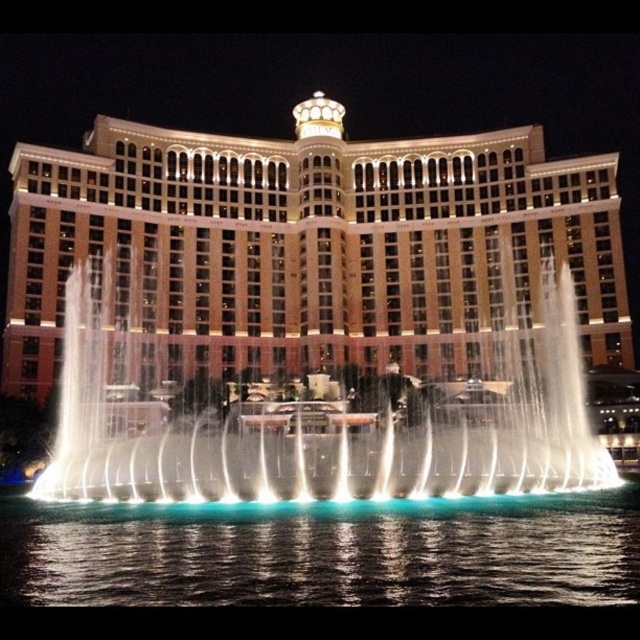
Between point (513, 372) and point (172, 520), which one is positioned behind?

The point (513, 372) is behind.

Is white water at center below blue liquid water at lower center?

No, white water at center is not below blue liquid water at lower center.

Is point (499, 435) positioned behind point (445, 525)?

Yes, point (499, 435) is behind point (445, 525).

In order to click on white water at center in this screenshot , I will do `click(317, 419)`.

Can you confirm if illuminated tan building at center is positioned to the left of white water at center?

Correct, you'll find illuminated tan building at center to the left of white water at center.

Image resolution: width=640 pixels, height=640 pixels. I want to click on illuminated tan building at center, so click(310, 244).

Image resolution: width=640 pixels, height=640 pixels. Describe the element at coordinates (310, 244) in the screenshot. I see `illuminated tan building at center` at that location.

Where is `illuminated tan building at center`? The image size is (640, 640). illuminated tan building at center is located at coordinates (310, 244).

Does point (321, 340) come in front of point (451, 588)?

That is False.

Which is behind, point (598, 209) or point (92, 595)?

Positioned behind is point (598, 209).

The width and height of the screenshot is (640, 640). Identify the location of illuminated tan building at center. (310, 244).

In order to click on illuminated tan building at center in this screenshot , I will do `click(310, 244)`.